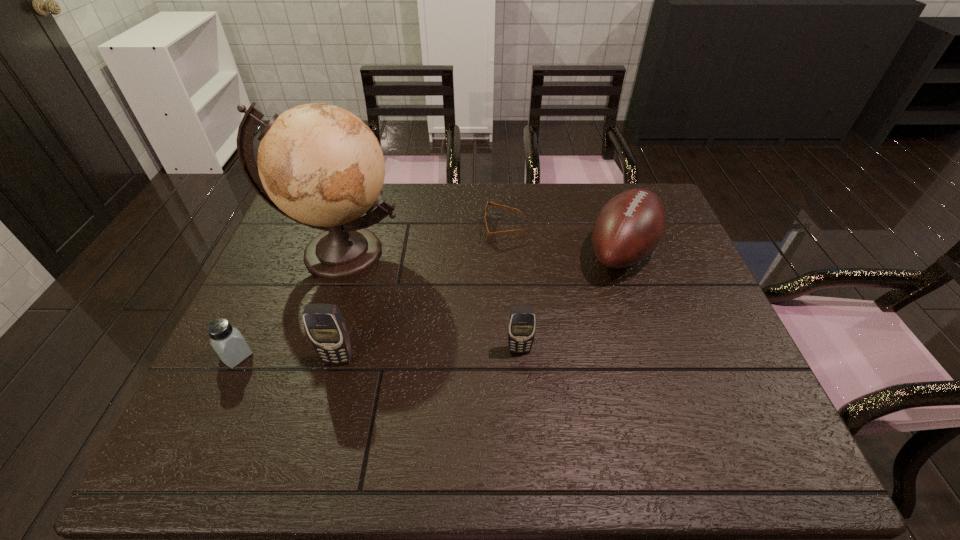
Where is `free space for a new cellular telephone on the right`? free space for a new cellular telephone on the right is located at coordinates (694, 340).